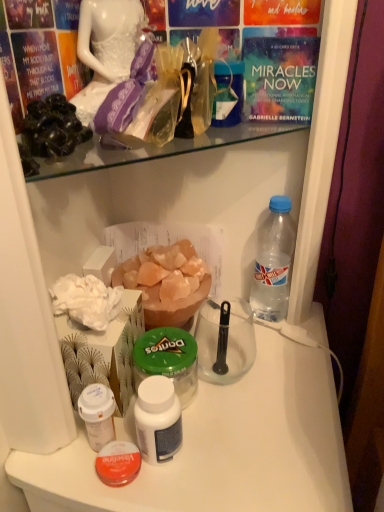
Locate an element on the screen. This screenshot has height=512, width=384. vacant area located to the right-hand side of white plastic cup at lower left, arranged as the 4th bottle when viewed from the right is located at coordinates (239, 429).